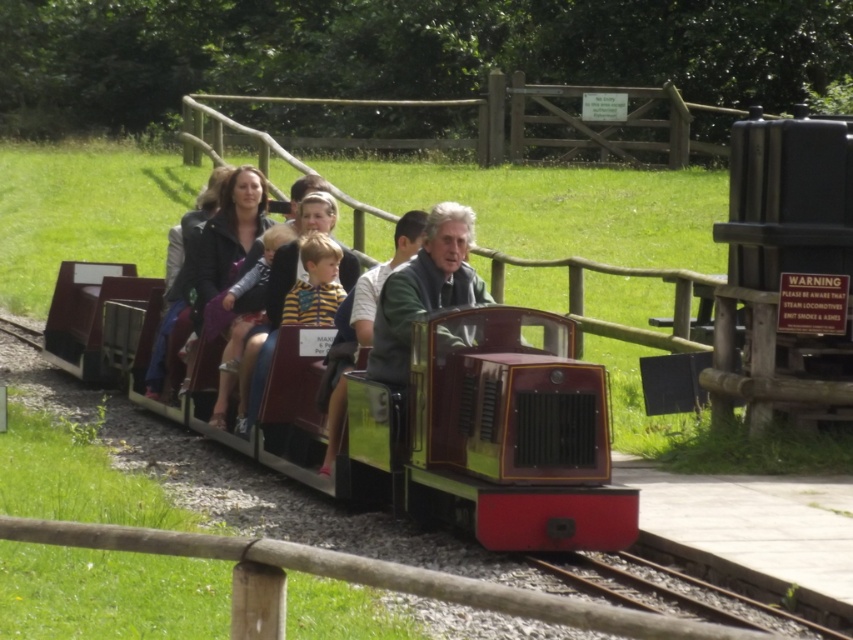
Question: Which is farther from the metallic train track at lower center?

Choices:
 (A) yellow striped sweater at center
 (B) matte black train car at center
 (C) metal rail at lower center

Answer: (C)

Question: Which object is the farthest from the metallic train track at lower center?

Choices:
 (A) shiny red train at center
 (B) matte black train car at center

Answer: (B)

Question: Is shiny red train at center below metal rail at lower center?

Choices:
 (A) no
 (B) yes

Answer: (A)

Question: Which point appears farthest from the camera in this image?

Choices:
 (A) (271, 321)
 (B) (662, 628)

Answer: (A)

Question: Can you confirm if shiny red train at center is positioned to the right of yellow striped sweater at center?

Choices:
 (A) no
 (B) yes

Answer: (B)

Question: Can you confirm if shiny red train at center is positioned to the left of metallic train track at lower center?

Choices:
 (A) yes
 (B) no

Answer: (A)